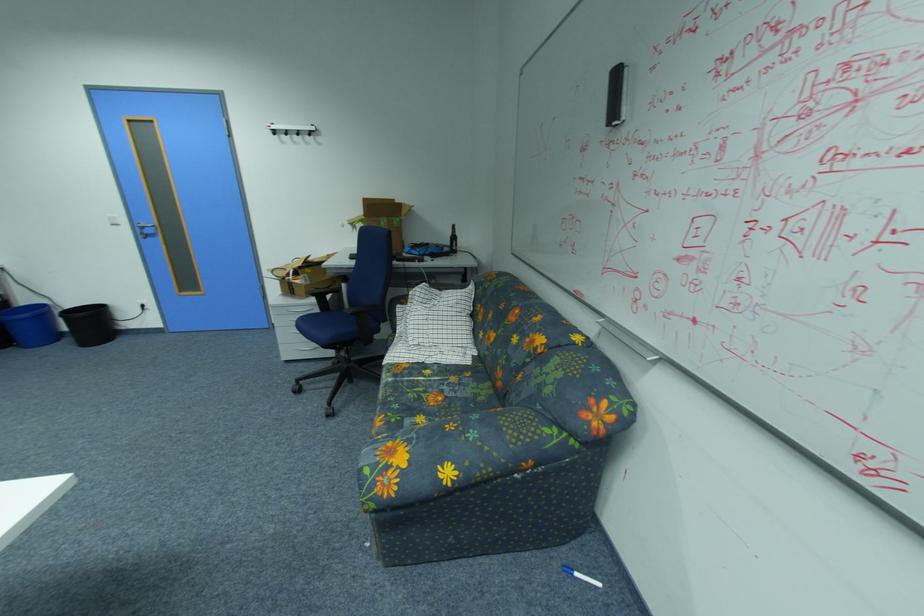
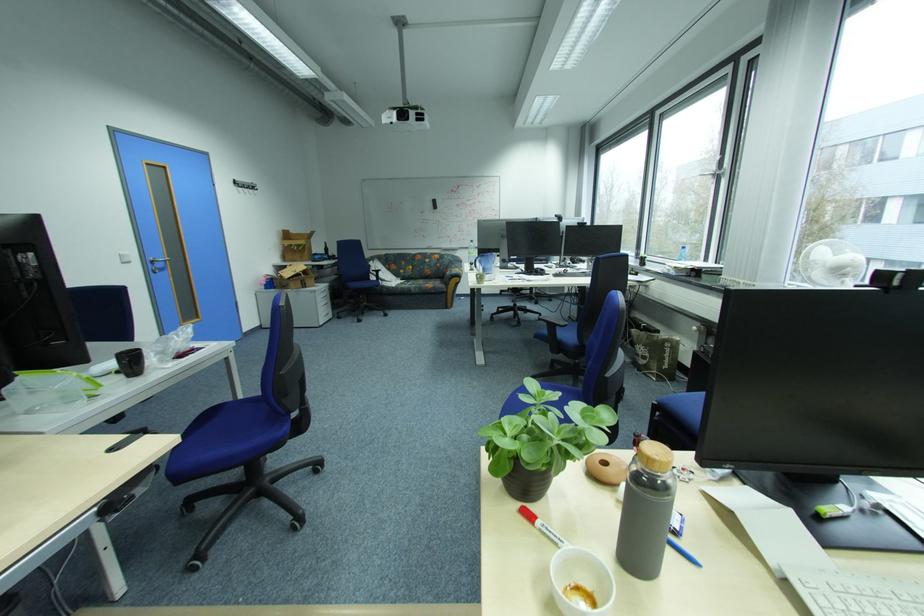
The point at (555,391) is marked in the first image. Where is the corresponding point in the second image?

(460, 261)